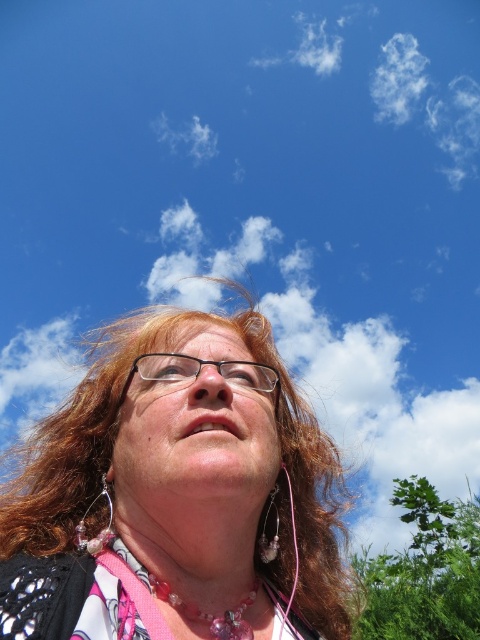
You are a photographer adjusting your camera settings to focus on the glasses. Which glasses should you focus on first if you want to capture both the matte black glasses at upper center and the clear plastic glasses at center in sharp detail?

The matte black glasses at upper center should be focused on first because it is closer to the viewer than the clear plastic glasses at center, ensuring both are in focus when using depth of field techniques.

You are a photographer trying to capture the perfect shot of the matte black glasses at upper center and the clear plastic glasses at center. Since you want to focus on the taller one, which glasses should you aim your camera at?

The matte black glasses at upper center is taller than the clear plastic glasses at center, so you should aim your camera at the matte black glasses at upper center to focus on the taller one.